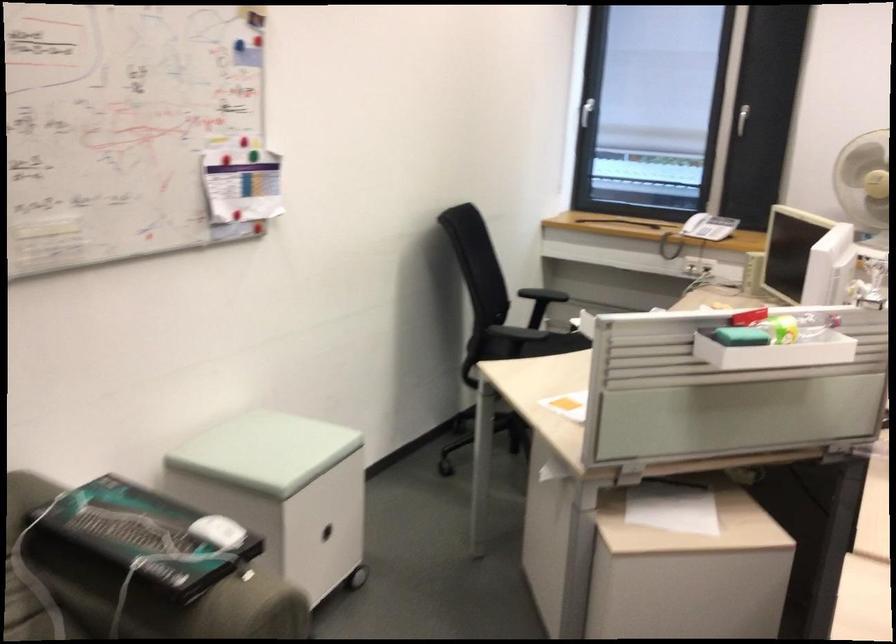
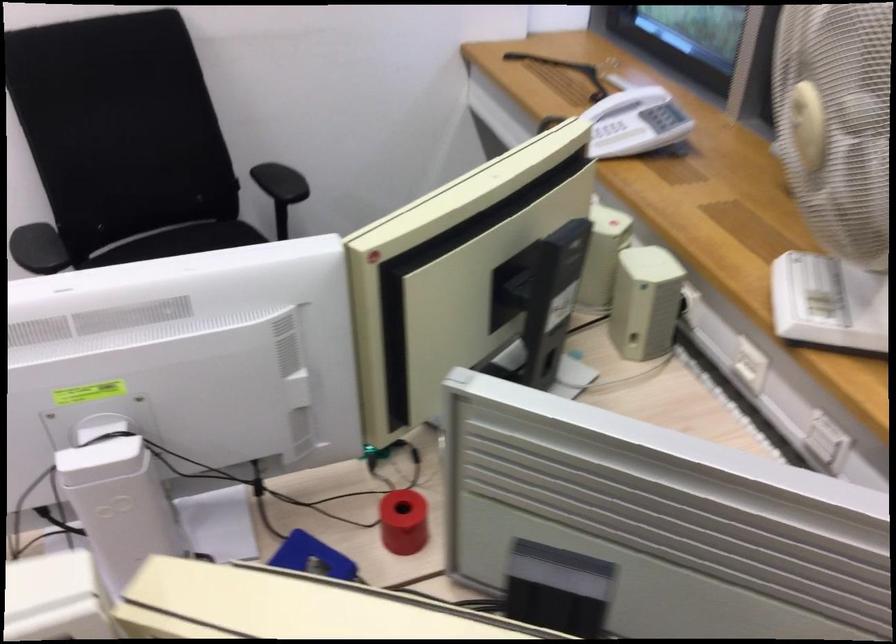
Find the pixel in the second image that matches (x=711, y=223) in the first image.

(612, 131)